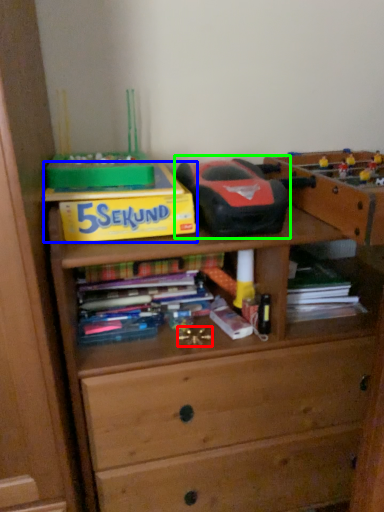
Question: Which object is positioned farthest from toy (highlighted by a red box)? Select from paperback book (highlighted by a blue box) and toy (highlighted by a green box).

Choices:
 (A) paperback book
 (B) toy

Answer: (B)